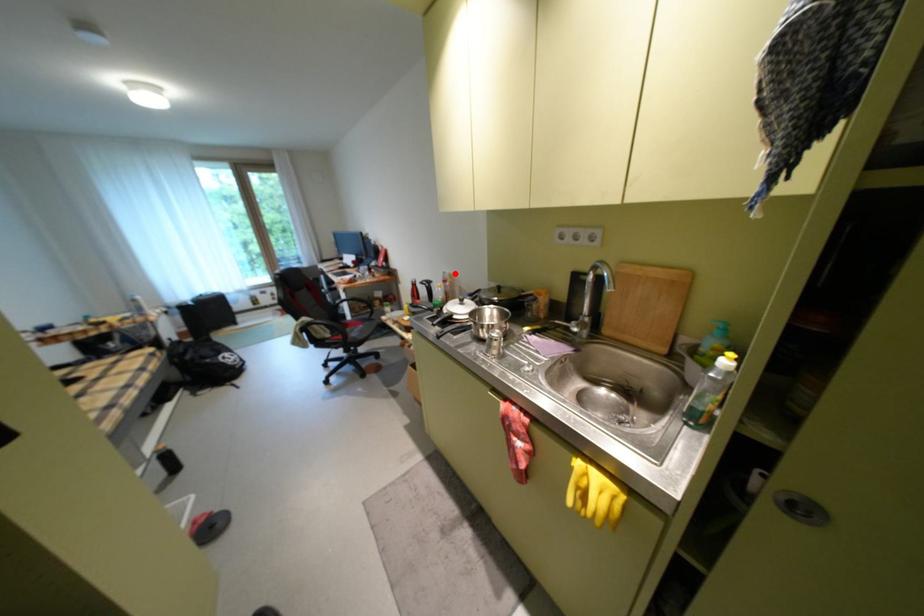
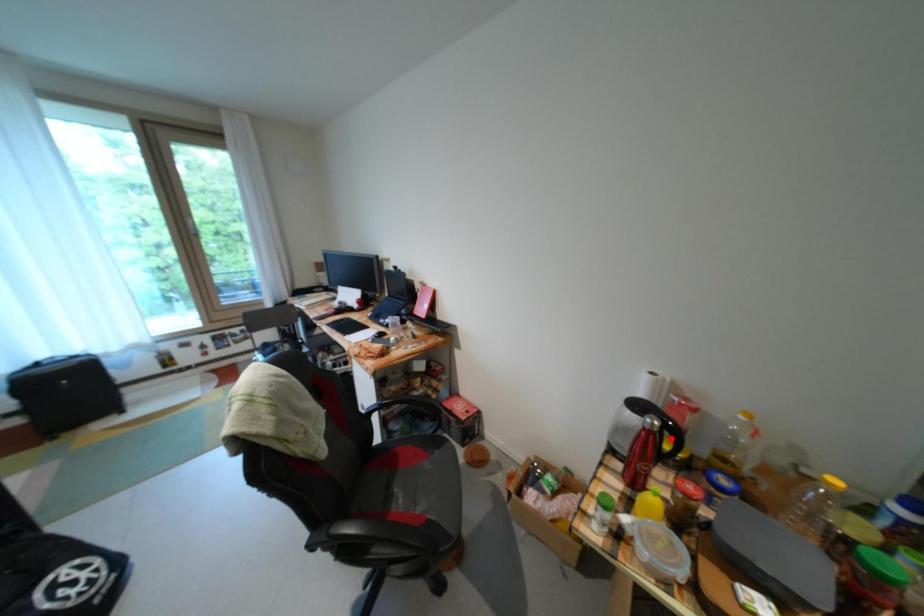
I am providing you with two images of the same scene from different viewpoints. A red point is marked on the first image and another point is marked on the second image. Is the red point in image1 aligned with the point shown in image2?

No